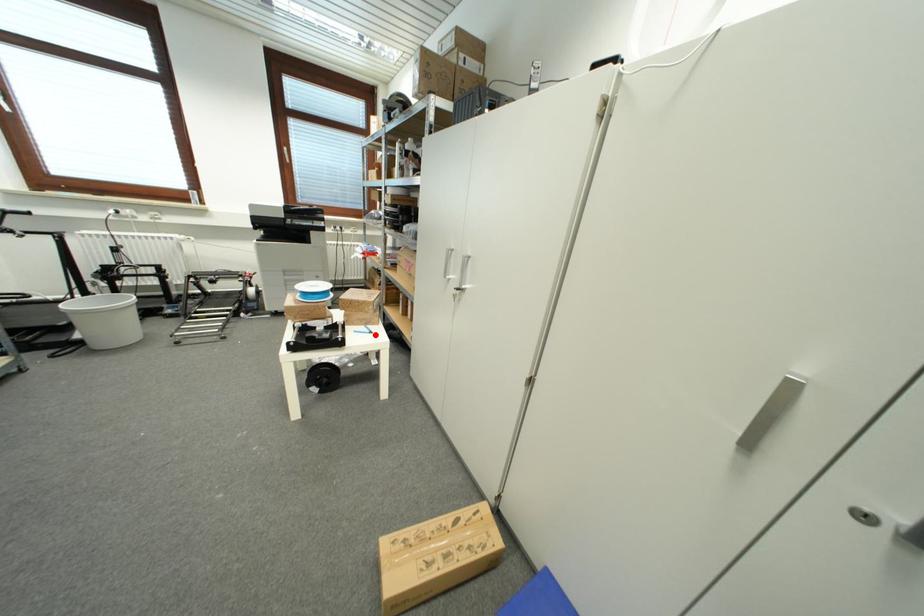
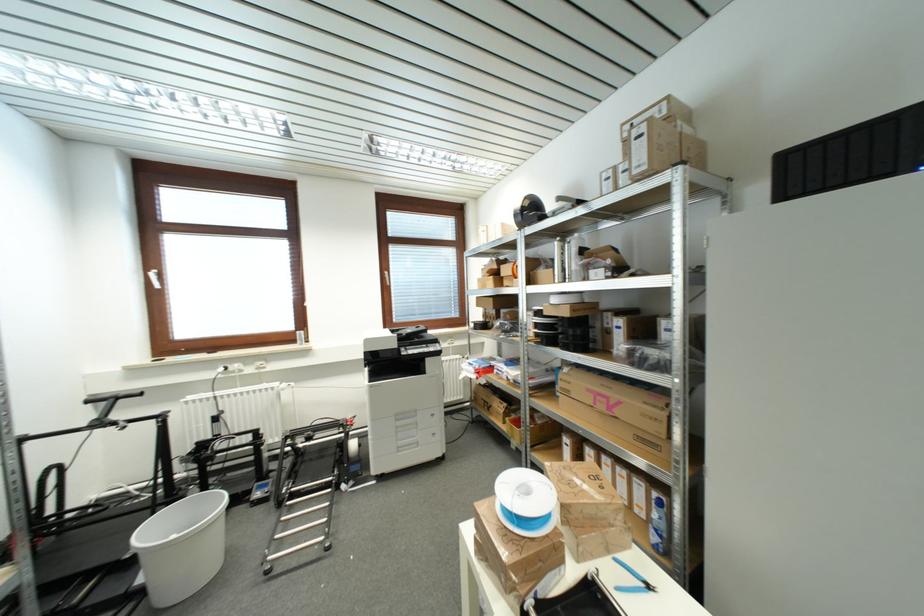
Question: I am providing you with two images of the same scene from different viewpoints. Given a red point in image1, look at the same physical point in image2. Is it:

Choices:
 (A) Closer to the viewpoint
 (B) Farther from the viewpoint

Answer: (B)